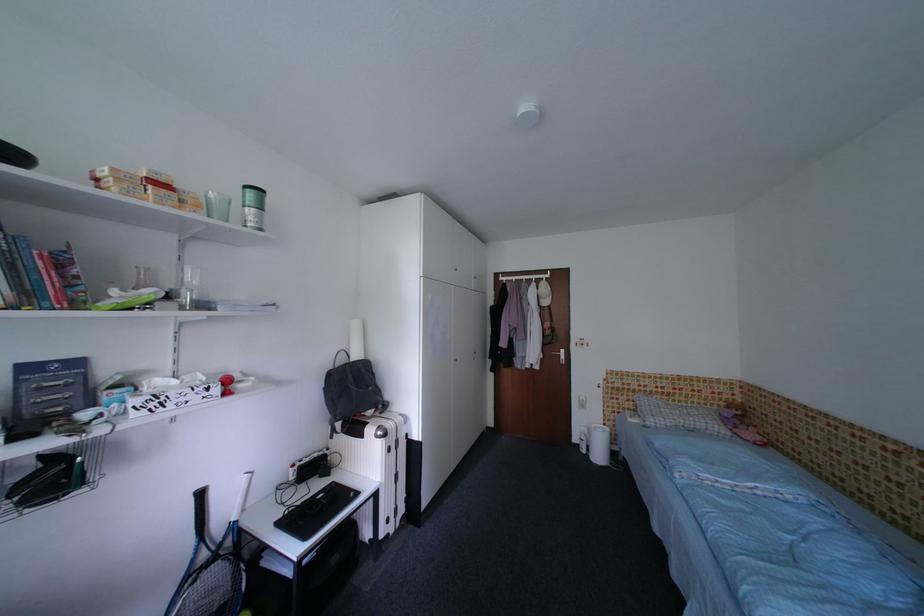
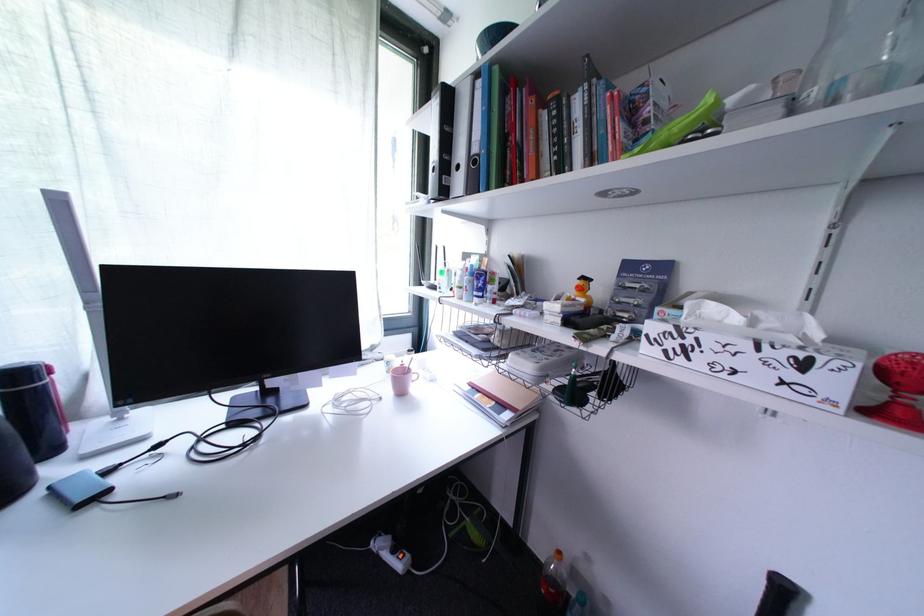
The point at (235, 395) is marked in the first image. Where is the corresponding point in the second image?

(897, 416)